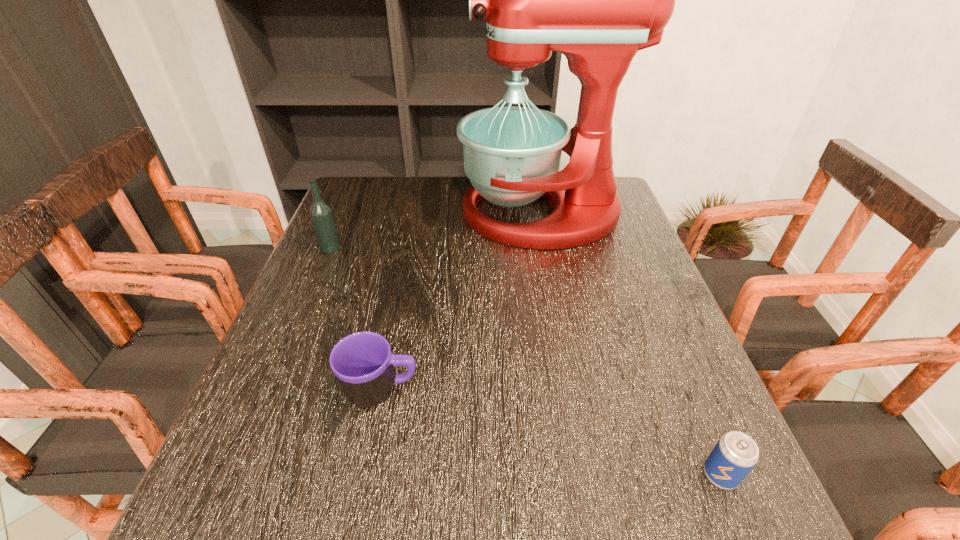
At what (x,y) coordinates should I click in order to perform the action: click on vacant space at the far edge of the desktop. Please return your answer as a coordinate pair (x, y). This screenshot has height=540, width=960. Looking at the image, I should click on (420, 181).

In the image, there is a desktop. Where is `free space at the near edge`? This screenshot has height=540, width=960. free space at the near edge is located at coordinates (452, 519).

The width and height of the screenshot is (960, 540). Identify the location of free space at the left edge of the desktop. (370, 278).

In the image, there is a desktop. Identify the location of vacant space at the right edge. (635, 357).

Locate an element on the screen. The image size is (960, 540). vacant area at the far left corner is located at coordinates (348, 196).

Find the location of a particular element. Image resolution: width=960 pixels, height=540 pixels. blank space at the near right corner of the desktop is located at coordinates (680, 525).

Where is `free space between the second shortest object and the tallest object`? free space between the second shortest object and the tallest object is located at coordinates (461, 302).

Locate an element on the screen. The image size is (960, 540). free space that is in between the mixer and the leftmost object is located at coordinates (436, 231).

What are the coordinates of `free spot between the leftmost object and the second shortest object` in the screenshot? It's located at (356, 319).

Find the location of `empty space between the tallest object and the shortest object`. empty space between the tallest object and the shortest object is located at coordinates (631, 344).